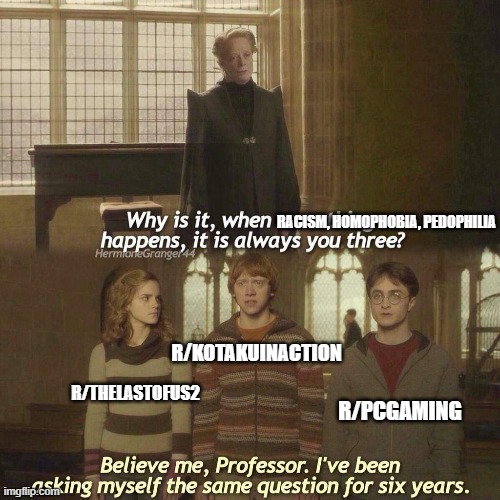
Where is `windows`? This screenshot has height=500, width=500. windows is located at coordinates (327, 290), (495, 300), (66, 87).